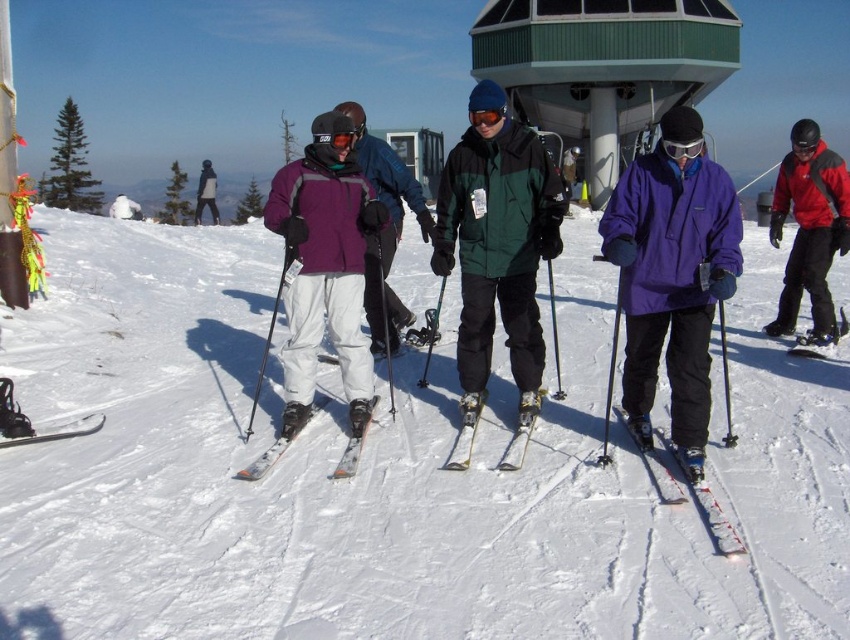
Which is above, matte purple jacket at center or yellow metallic ski at center?

Positioned higher is matte purple jacket at center.

This screenshot has width=850, height=640. Describe the element at coordinates (326, 266) in the screenshot. I see `matte purple jacket at center` at that location.

At what (x,y) coordinates should I click in order to perform the action: click on matte purple jacket at center. Please return your answer as a coordinate pair (x, y). This screenshot has width=850, height=640. Looking at the image, I should click on (326, 266).

Which of these two, green matte jacket at center or yellow metallic ski at center, stands shorter?

With less height is yellow metallic ski at center.

Can you confirm if green matte jacket at center is positioned to the right of yellow metallic ski at center?

Indeed, green matte jacket at center is positioned on the right side of yellow metallic ski at center.

Identify the location of green matte jacket at center. 497,252.

What do you see at coordinates (520, 429) in the screenshot? I see `yellow metallic ski at center` at bounding box center [520, 429].

In the scene shown: Does yellow metallic ski at center appear on the left side of orange metallic ski at center?

Incorrect, yellow metallic ski at center is not on the left side of orange metallic ski at center.

The image size is (850, 640). What are the coordinates of `yellow metallic ski at center` in the screenshot? It's located at (520, 429).